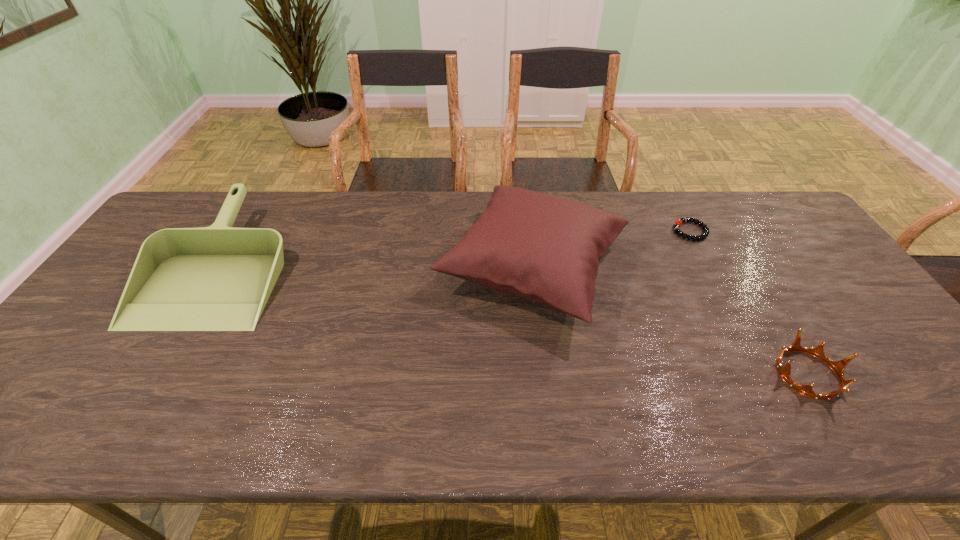
Identify the location of free spot between the third tallest object and the bracelet. This screenshot has height=540, width=960. (749, 302).

This screenshot has width=960, height=540. Find the location of `free space between the second shortest object and the shortest object`. free space between the second shortest object and the shortest object is located at coordinates (749, 302).

Locate an element on the screen. This screenshot has width=960, height=540. free space between the bracelet and the crown is located at coordinates (749, 302).

Find the location of a particular element. unoccupied area between the tallest object and the shortest object is located at coordinates (612, 249).

Where is `vacant area that lies between the third tallest object and the dustpan`? vacant area that lies between the third tallest object and the dustpan is located at coordinates (515, 319).

Locate an element on the screen. This screenshot has height=540, width=960. vacant area that lies between the crown and the bracelet is located at coordinates [x=749, y=302].

Locate an element on the screen. The image size is (960, 540). vacant space in between the bracelet and the third tallest object is located at coordinates (749, 302).

Find the location of a particular element. The image size is (960, 540). free space between the shortest object and the crown is located at coordinates (749, 302).

You are a GUI agent. You are given a task and a screenshot of the screen. Output one action in this format:
    pyautogui.click(x=<x>, y=<y>)
    Task: Click on the vacant space that's between the second tallest object and the crown
    
    Given the screenshot: What is the action you would take?
    pyautogui.click(x=515, y=319)

This screenshot has height=540, width=960. I want to click on free point between the third tallest object and the third object from right to left, so [x=670, y=321].